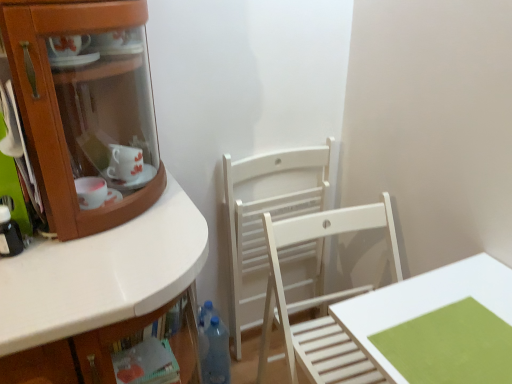
You are a GUI agent. You are given a task and a screenshot of the screen. Output one action in this format:
    pyautogui.click(x=<x>, y=<y>)
    Task: Click on the vacant space situated above white matte table at lower right (from a real-world perspective)
    The image size is (512, 384).
    Given the screenshot: What is the action you would take?
    pyautogui.click(x=448, y=317)